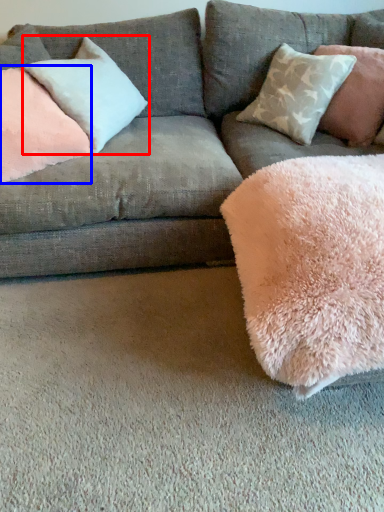
Question: Which object is further to the camera taking this photo, pillow (highlighted by a red box) or pillow (highlighted by a blue box)?

Choices:
 (A) pillow
 (B) pillow

Answer: (A)